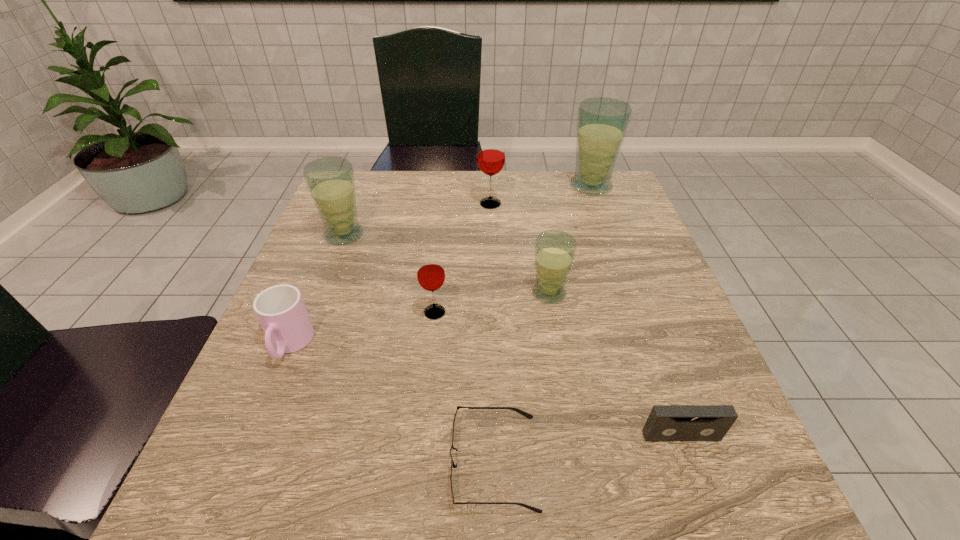
Find the location of a particular element. Image resolution: width=960 pixels, height=540 pixels. the sixth tallest object is located at coordinates pos(280,309).

I want to click on videotape, so click(665, 422).

This screenshot has width=960, height=540. Find the location of `the shortest object`. the shortest object is located at coordinates (529, 416).

The width and height of the screenshot is (960, 540). Find the location of `spectacles`. spectacles is located at coordinates (529, 416).

Where is `free region located 0.270m on the left of the farthest blue glass`? The width and height of the screenshot is (960, 540). free region located 0.270m on the left of the farthest blue glass is located at coordinates (471, 186).

Find the location of a particular element. The image size is (960, 540). vacant region located 0.330m on the right of the bigger red glass is located at coordinates (628, 204).

Locate an element on the screen. vacant region located 0.110m on the back of the leftmost blue glass is located at coordinates (358, 199).

Where is `free location located 0.080m on the back of the nearest blue glass`? This screenshot has width=960, height=540. free location located 0.080m on the back of the nearest blue glass is located at coordinates (543, 256).

This screenshot has height=540, width=960. I want to click on vacant space located 0.140m on the front of the third object from left to right, so click(427, 383).

Locate an element on the screen. This screenshot has width=960, height=540. vacant area located with the handle on the side of the third shortest object is located at coordinates pos(269,396).